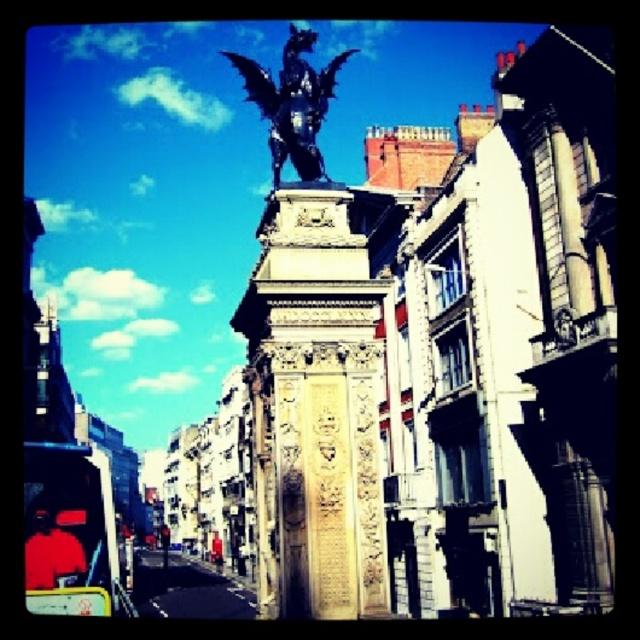
Is point (362, 612) closer to camera compared to point (300, 104)?

Yes.

Who is positioned more to the left, black polished stone statue at center or shiny black dragon at upper center?

black polished stone statue at center

Find the location of a particular element. black polished stone statue at center is located at coordinates (310, 368).